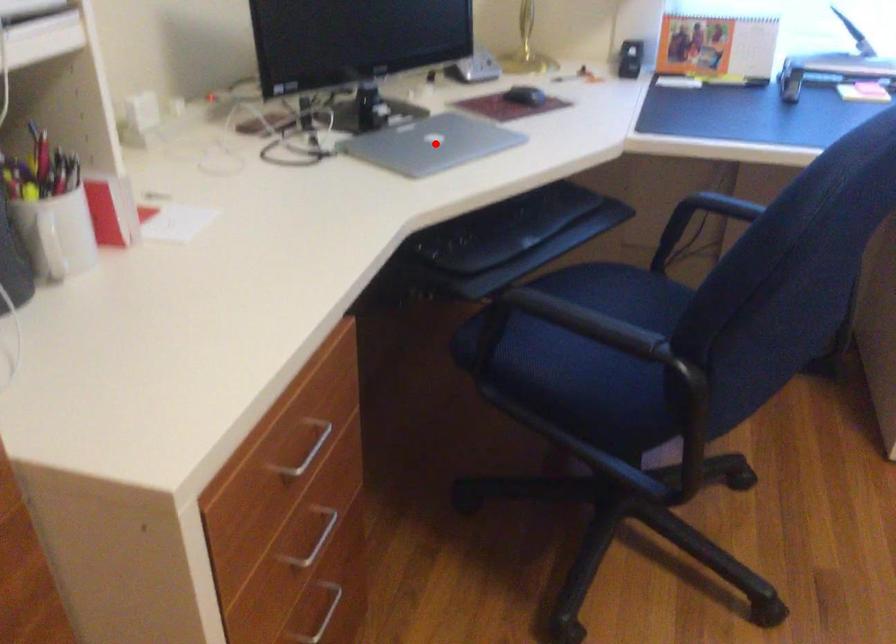
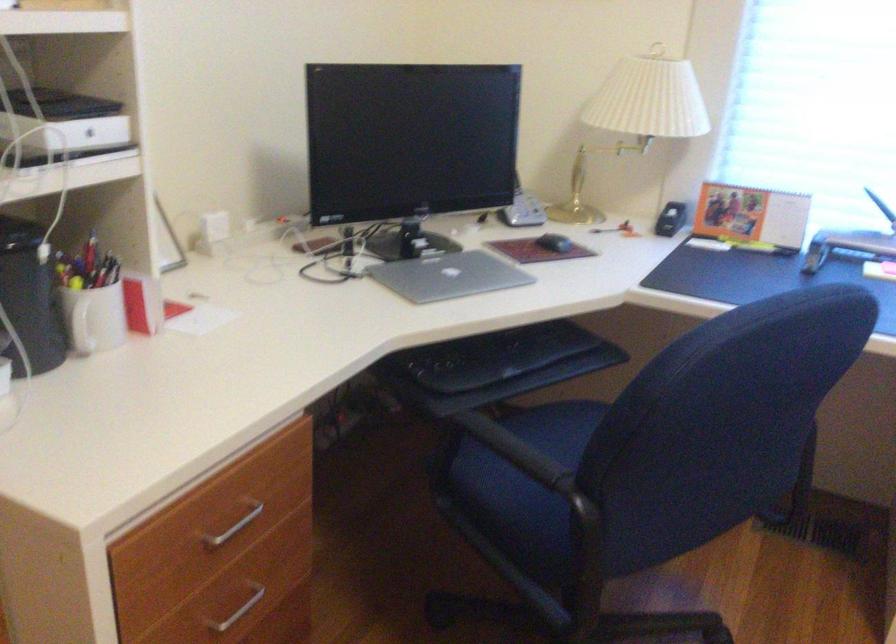
Question: A red point is marked in image1. In image2, is the corresponding 3D point closer to the camera or farther? Reply with the corresponding letter.

Choices:
 (A) The corresponding 3D point is closer.
 (B) The corresponding 3D point is farther.

Answer: (B)